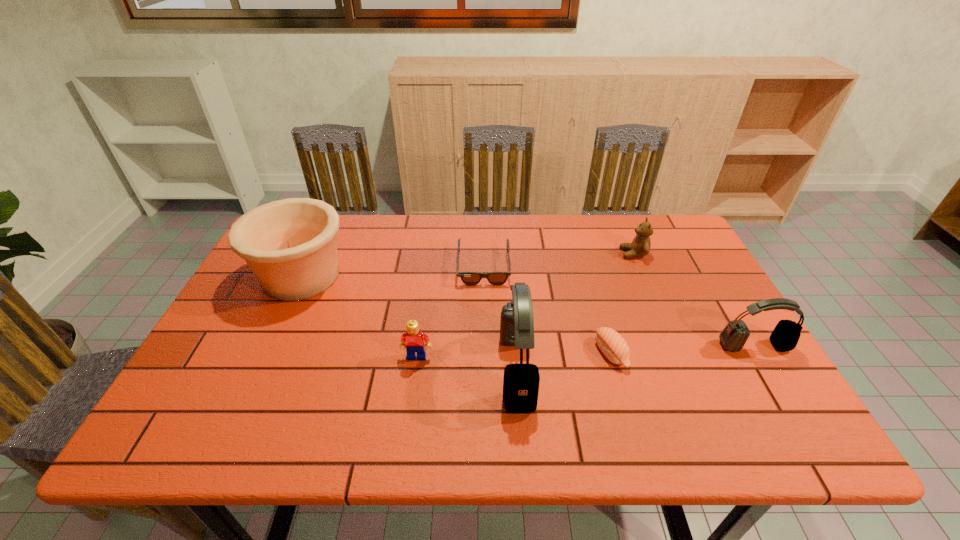
Identify the location of the left headset. The image size is (960, 540). pos(521,381).

Identify the location of the tallest object. The width and height of the screenshot is (960, 540). (521, 381).

Image resolution: width=960 pixels, height=540 pixels. I want to click on the shorter headset, so click(785, 336).

The image size is (960, 540). Find the location of `the rightmost object`. the rightmost object is located at coordinates (785, 336).

Where is `teddy bear`? Image resolution: width=960 pixels, height=540 pixels. teddy bear is located at coordinates pyautogui.click(x=640, y=246).

The image size is (960, 540). Identify the location of the second tallest object. (290, 245).

Identify the location of the leftmost object. The height and width of the screenshot is (540, 960). pos(290,245).

In order to click on the shortest object in this screenshot , I will do click(x=469, y=278).

This screenshot has height=540, width=960. Identify the location of sushi. (611, 343).

Locate an element on the screen. Image resolution: width=960 pixels, height=540 pixels. the second shortest object is located at coordinates (611, 343).